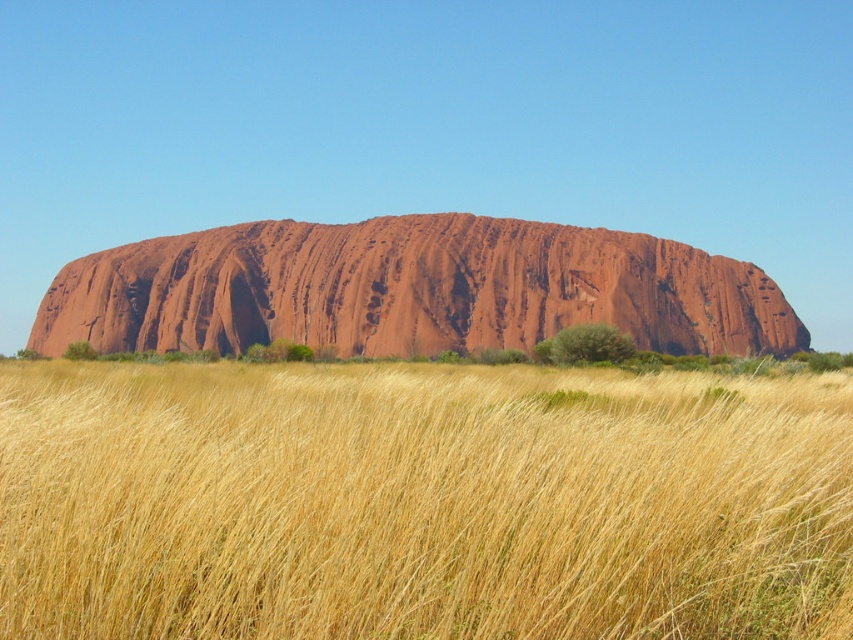
Does yellow grass at center have a larger size compared to rustic sandstone rock formation at center?

No, yellow grass at center is not bigger than rustic sandstone rock formation at center.

Does point (100, 593) lie behind point (142, 243)?

No, it is not.

Where is `yellow grass at center`? The image size is (853, 640). yellow grass at center is located at coordinates (421, 502).